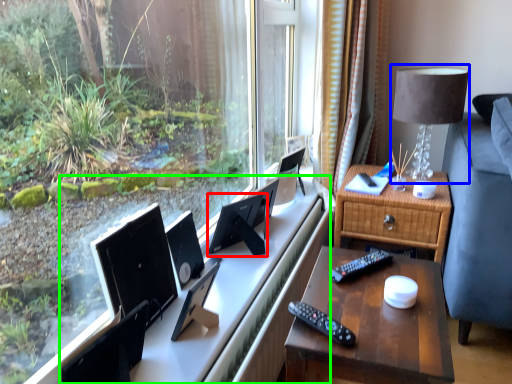
Question: Which object is the farthest from computer monitor (highlighted by a red box)? Choose among these: table lamp (highlighted by a blue box) or computer desk (highlighted by a green box).

Choices:
 (A) table lamp
 (B) computer desk

Answer: (A)